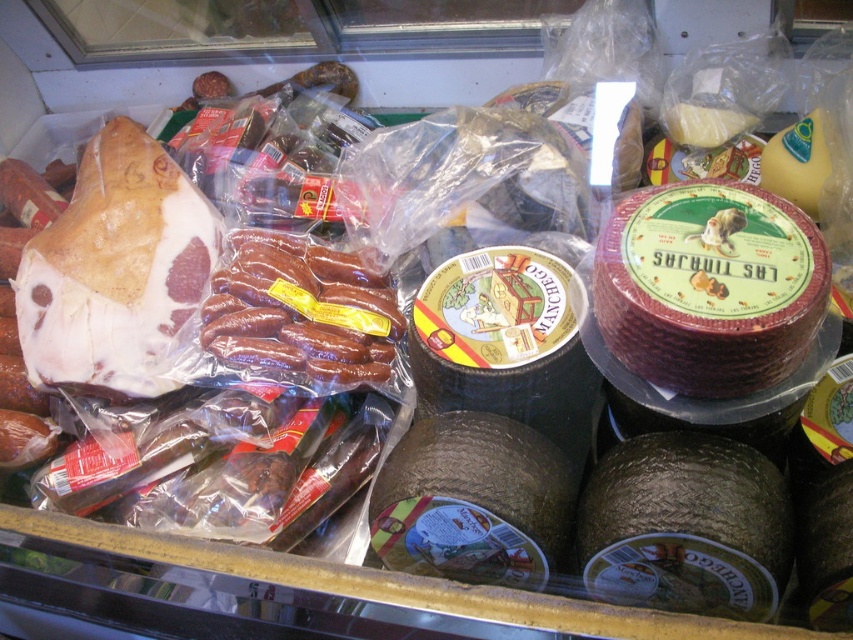
Does red textured cheese at center right lie in front of brown glossy sausages at center?

Yes, red textured cheese at center right is in front of brown glossy sausages at center.

Who is lower down, red textured cheese at center right or brown glossy sausages at center?

brown glossy sausages at center

Where is `red textured cheese at center right`? This screenshot has height=640, width=853. red textured cheese at center right is located at coordinates (709, 285).